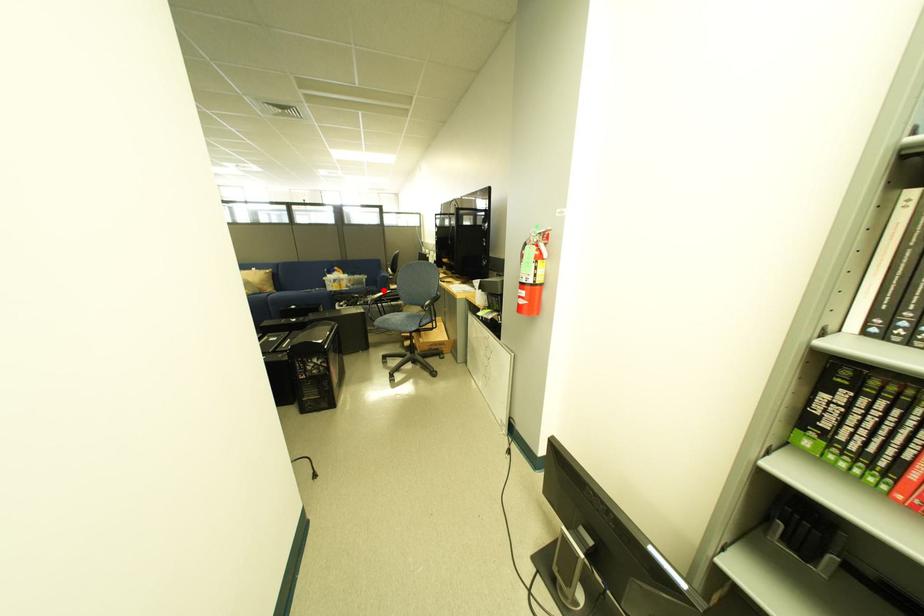
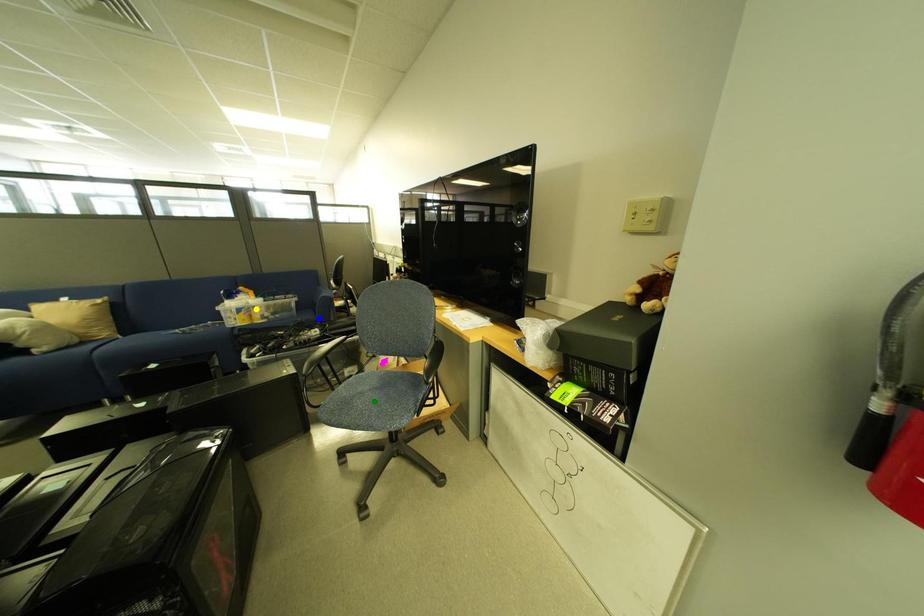
Question: I am providing you with two images of the same scene from different viewpoints. A red point is marked on the first image. You are given multiple points on the second image. Which mark in image 2 goes with the point in image 1?

Choices:
 (A) blue point
 (B) yellow point
 (C) green point

Answer: (A)